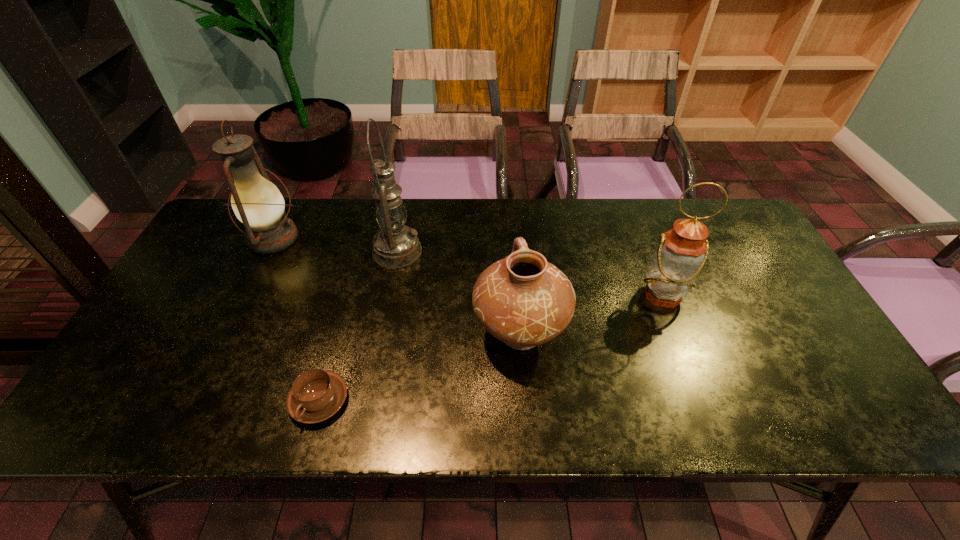
Where is `free space at the right edge`? free space at the right edge is located at coordinates (732, 261).

Find the location of a particular element. vacant point located between the leftmost object and the second oil lamp from left to right is located at coordinates (336, 245).

In order to click on blank region between the rightmost object and the fourth tallest object in this screenshot , I will do `click(590, 314)`.

You are a GUI agent. You are given a task and a screenshot of the screen. Output one action in this format:
    pyautogui.click(x=<x>, y=<y>)
    Task: Click on the vacant area between the second oil lamp from left to right and the second object from right to left
    Image resolution: width=960 pixels, height=540 pixels.
    Given the screenshot: What is the action you would take?
    pyautogui.click(x=459, y=292)

This screenshot has width=960, height=540. I want to click on free point between the second oil lamp from right to left and the leftmost object, so click(336, 245).

Where is `free space between the nearest oil lamp and the pottery`? The width and height of the screenshot is (960, 540). free space between the nearest oil lamp and the pottery is located at coordinates (590, 314).

Locate an element on the screen. unoccupied area between the second oil lamp from right to left and the shortest object is located at coordinates (358, 326).

Image resolution: width=960 pixels, height=540 pixels. I want to click on free spot between the leftmost oil lamp and the nearest object, so click(x=297, y=319).

Locate an element on the screen. This screenshot has width=960, height=540. free spot between the leftmost oil lamp and the second oil lamp from right to left is located at coordinates (336, 245).

You are a GUI agent. You are given a task and a screenshot of the screen. Output one action in this format:
    pyautogui.click(x=<x>, y=<y>)
    Task: Click on the vacant area that lies between the fourth tallest object and the shortest object
    
    Given the screenshot: What is the action you would take?
    pyautogui.click(x=420, y=367)